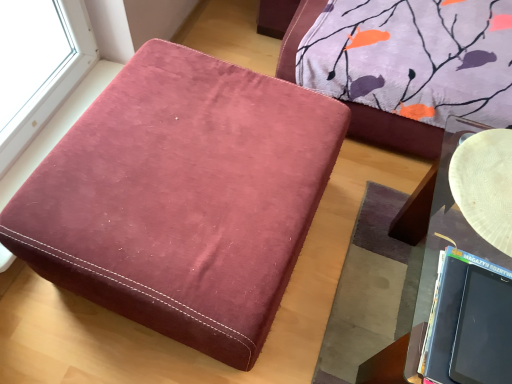
Question: From a real-world perspective, is velvet-like burgundy ottoman at center on top of matte black laptop at lower right?

Choices:
 (A) no
 (B) yes

Answer: (A)

Question: Does velvet-like burgundy ottoman at center have a lesser height compared to matte black laptop at lower right?

Choices:
 (A) no
 (B) yes

Answer: (A)

Question: Is velvet-like burgundy ottoman at center in front of matte black laptop at lower right?

Choices:
 (A) no
 (B) yes

Answer: (A)

Question: Is velvet-like burgundy ottoman at center surrounding matte black laptop at lower right?

Choices:
 (A) no
 (B) yes

Answer: (A)

Question: Is velvet-like burgundy ottoman at center not close to matte black laptop at lower right?

Choices:
 (A) yes
 (B) no

Answer: (B)

Question: From a real-world perspective, is white textured plate at right physically located above or below matte black laptop at lower right?

Choices:
 (A) above
 (B) below

Answer: (B)

Question: Is white textured plate at right inside the boundaries of matte black laptop at lower right, or outside?

Choices:
 (A) outside
 (B) inside

Answer: (A)

Question: From the image's perspective, is white textured plate at right positioned above or below matte black laptop at lower right?

Choices:
 (A) above
 (B) below

Answer: (A)

Question: In terms of height, does white textured plate at right look taller or shorter compared to matte black laptop at lower right?

Choices:
 (A) tall
 (B) short

Answer: (B)

Question: From the image's perspective, is velvet-like burgundy ottoman at center above or below white textured plate at right?

Choices:
 (A) above
 (B) below

Answer: (B)

Question: Is point pyautogui.click(x=52, y=208) positioned closer to the camera than point pyautogui.click(x=502, y=130)?

Choices:
 (A) closer
 (B) farther

Answer: (A)

Question: Is velvet-like burgundy ottoman at center in front of or behind white textured plate at right in the image?

Choices:
 (A) front
 (B) behind

Answer: (A)

Question: Looking at the image, does velvet-like burgundy ottoman at center seem bigger or smaller compared to white textured plate at right?

Choices:
 (A) small
 (B) big

Answer: (B)

Question: Is matte black laptop at lower right wider or thinner than white textured plate at right?

Choices:
 (A) thin
 (B) wide

Answer: (A)

Question: From a real-world perspective, relative to white textured plate at right, is matte black laptop at lower right vertically above or below?

Choices:
 (A) above
 (B) below

Answer: (A)